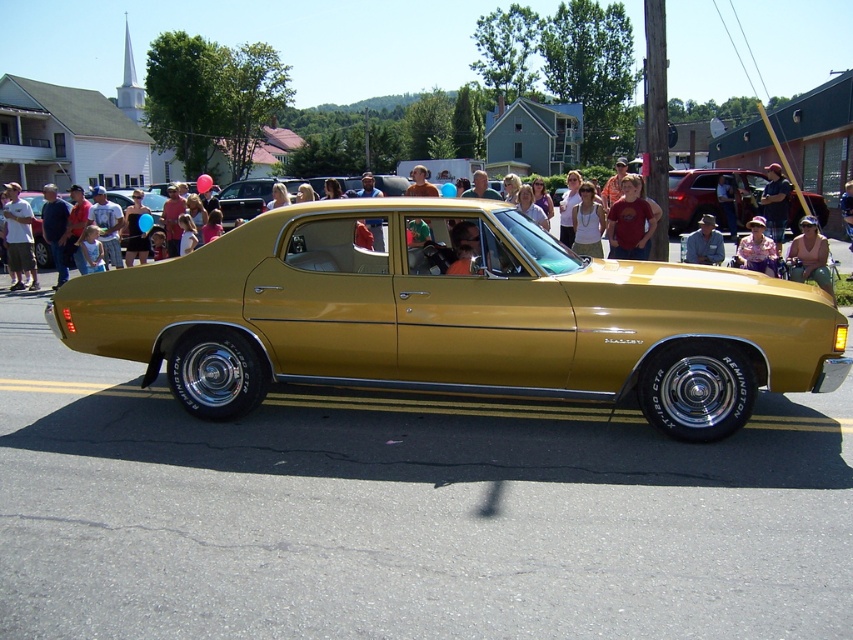
You are a photographer trying to capture a photo of the gold shiny sedan at center and the dark blue shirt at center. Based on their heights, which one should you focus on first if you want to frame them both without adjusting your camera angle?

The gold shiny sedan at center is not as tall as the dark blue shirt at center, so you should focus on the dark blue shirt at center first to ensure it fits within the frame.